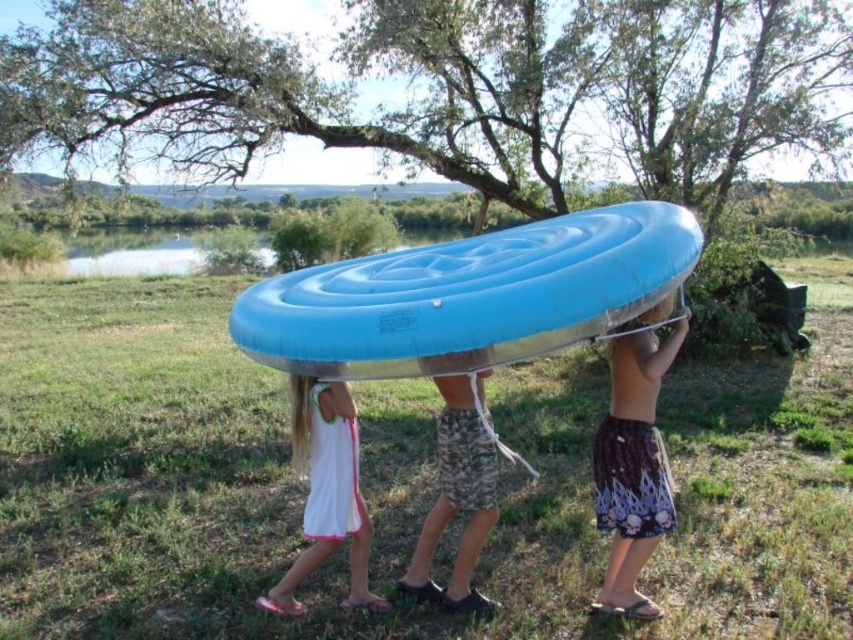
Question: Which point is farther from the camera taking this photo?

Choices:
 (A) (460, 492)
 (B) (323, 550)
 (C) (242, 323)

Answer: (B)

Question: Is blue rubber raft at center smaller than white cotton dress at center?

Choices:
 (A) yes
 (B) no

Answer: (B)

Question: Considering the relative positions of printed cotton shorts at center and white cotton dress at center in the image provided, where is printed cotton shorts at center located with respect to white cotton dress at center?

Choices:
 (A) below
 (B) above

Answer: (B)

Question: Is blue rubber raft at center to the left of white cotton dress at center from the viewer's perspective?

Choices:
 (A) yes
 (B) no

Answer: (B)

Question: Which point appears farthest from the camera in this image?

Choices:
 (A) (624, 289)
 (B) (634, 376)
 (C) (448, 602)

Answer: (C)

Question: Which point appears farthest from the camera in this image?

Choices:
 (A) (627, 301)
 (B) (643, 513)
 (C) (444, 500)

Answer: (C)